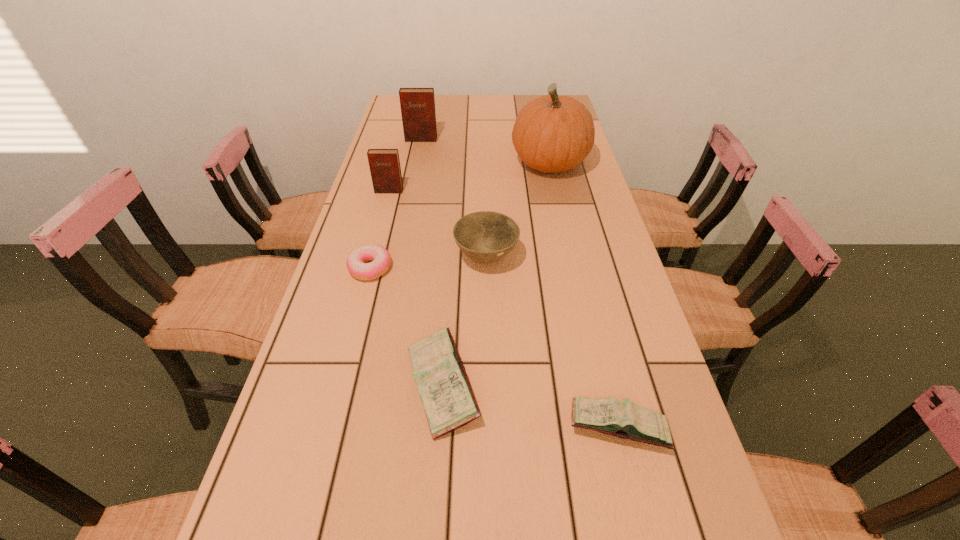
Identify the location of vacant space that satisfies the following two spatial constraints: 1. on the stem of the second shortest object; 2. on the right side of the tallest object. (608, 427).